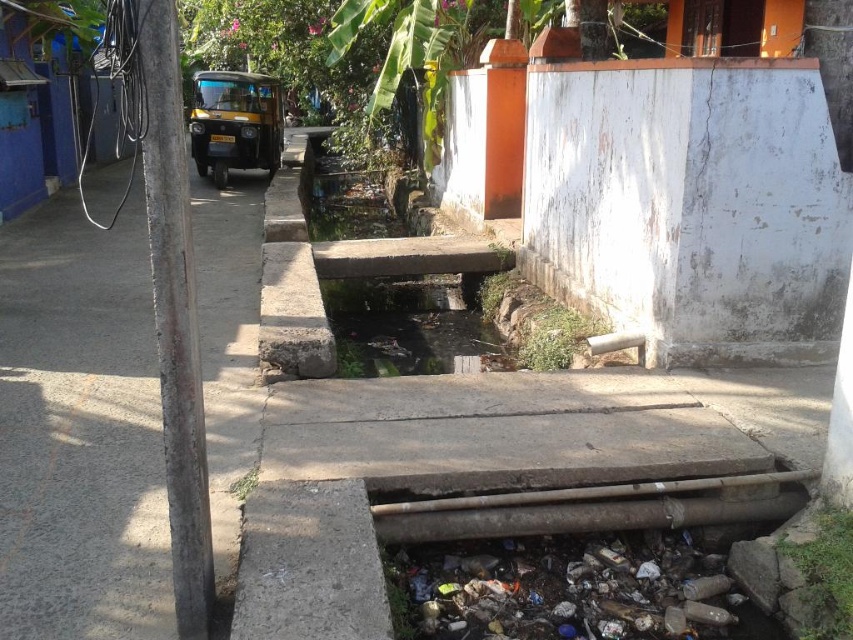
You are a delivery person trying to avoid stepping into the canal. You see the gray concrete pavement at left and the clear concrete water at center. Which surface is lower and safer to walk on?

The gray concrete pavement at left is not as tall as clear concrete water at center, so it is lower and safer to walk on.